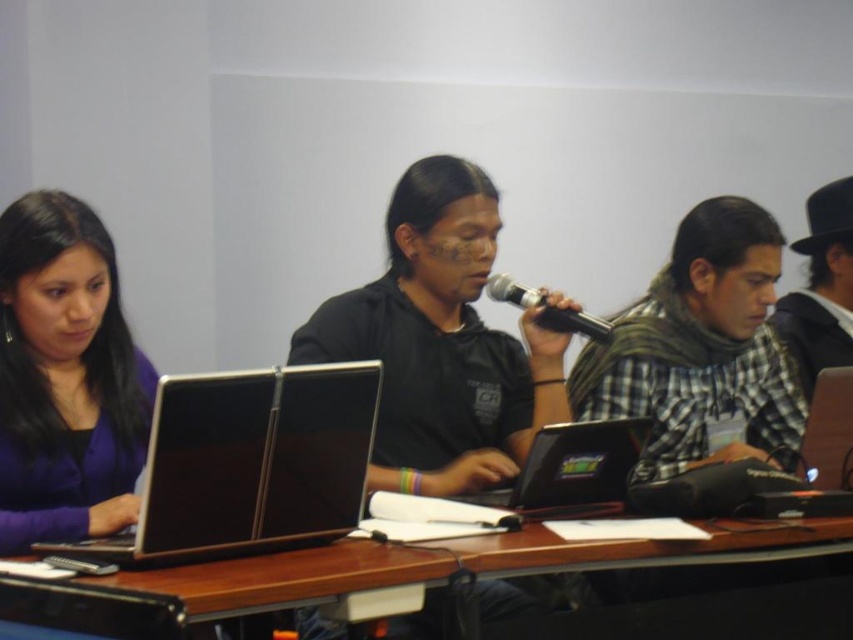
Question: Which is nearer to the checkered fabric scarf at right?

Choices:
 (A) black matte microphone at center
 (B) wooden table at center
 (C) black matte shirt at center

Answer: (A)

Question: Based on their relative distances, which object is nearer to the matte black laptop at left?

Choices:
 (A) shiny black laptop at center
 (B) black matte shirt at center
 (C) checkered fabric shirt at right
 (D) checkered fabric scarf at right

Answer: (B)

Question: Does black matte shirt at center come in front of wooden table at center?

Choices:
 (A) no
 (B) yes

Answer: (A)

Question: Is black matte shirt at center below black matte microphone at center?

Choices:
 (A) yes
 (B) no

Answer: (A)

Question: Can you confirm if purple matte shirt at left is positioned to the left of checkered fabric shirt at right?

Choices:
 (A) no
 (B) yes

Answer: (B)

Question: Which object is farther from the camera taking this photo?

Choices:
 (A) purple matte shirt at left
 (B) shiny black laptop at center
 (C) black matte shirt at center
 (D) matte black laptop at left

Answer: (C)